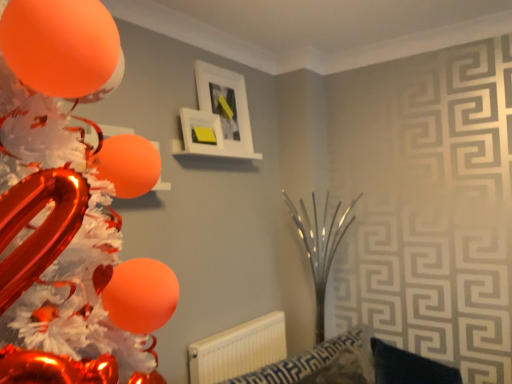
Question: Is orange glossy balloon at left bigger than white plastic radiator at lower center?

Choices:
 (A) no
 (B) yes

Answer: (B)

Question: Is orange glossy balloon at left at the right side of white plastic radiator at lower center?

Choices:
 (A) no
 (B) yes

Answer: (A)

Question: Is orange glossy balloon at left turned away from white plastic radiator at lower center?

Choices:
 (A) yes
 (B) no

Answer: (B)

Question: Does orange glossy balloon at left appear on the left side of white plastic radiator at lower center?

Choices:
 (A) yes
 (B) no

Answer: (A)

Question: Does orange glossy balloon at left have a greater height compared to white plastic radiator at lower center?

Choices:
 (A) no
 (B) yes

Answer: (B)

Question: From the image's perspective, is white matte picture frame at upper center, the 2th picture frame in the back-to-front sequence, above or below white matte picture frame at upper center, positioned as the 2th picture frame in front-to-back order?

Choices:
 (A) above
 (B) below

Answer: (B)

Question: Is white matte picture frame at upper center, the first picture frame viewed from the front, spatially inside white matte picture frame at upper center, positioned as the 2th picture frame in front-to-back order, or outside of it?

Choices:
 (A) outside
 (B) inside

Answer: (A)

Question: From a real-world perspective, is white matte picture frame at upper center, the first picture frame viewed from the front, positioned above or below white matte picture frame at upper center, which is counted as the first picture frame, starting from the back?

Choices:
 (A) below
 (B) above

Answer: (A)

Question: From their relative heights in the image, would you say white matte picture frame at upper center, the 2th picture frame in the back-to-front sequence, is taller or shorter than white matte picture frame at upper center, positioned as the 2th picture frame in front-to-back order?

Choices:
 (A) short
 (B) tall

Answer: (A)

Question: From their relative heights in the image, would you say white plastic radiator at lower center is taller or shorter than white matte picture frame at upper center, the 2th picture frame in the back-to-front sequence?

Choices:
 (A) tall
 (B) short

Answer: (A)

Question: Is white plastic radiator at lower center wider or thinner than white matte picture frame at upper center, the first picture frame viewed from the front?

Choices:
 (A) thin
 (B) wide

Answer: (A)

Question: Based on their sizes in the image, would you say white plastic radiator at lower center is bigger or smaller than white matte picture frame at upper center, the 2th picture frame in the back-to-front sequence?

Choices:
 (A) small
 (B) big

Answer: (B)

Question: Considering the positions of point (202, 347) and point (200, 150), is point (202, 347) closer or farther from the camera than point (200, 150)?

Choices:
 (A) closer
 (B) farther

Answer: (A)

Question: Which is correct: white matte picture frame at upper center, positioned as the 2th picture frame in front-to-back order, is inside white matte picture frame at upper center, the first picture frame viewed from the front, or outside of it?

Choices:
 (A) outside
 (B) inside

Answer: (A)

Question: Is white matte picture frame at upper center, positioned as the 2th picture frame in front-to-back order, bigger or smaller than white matte picture frame at upper center, the first picture frame viewed from the front?

Choices:
 (A) big
 (B) small

Answer: (A)